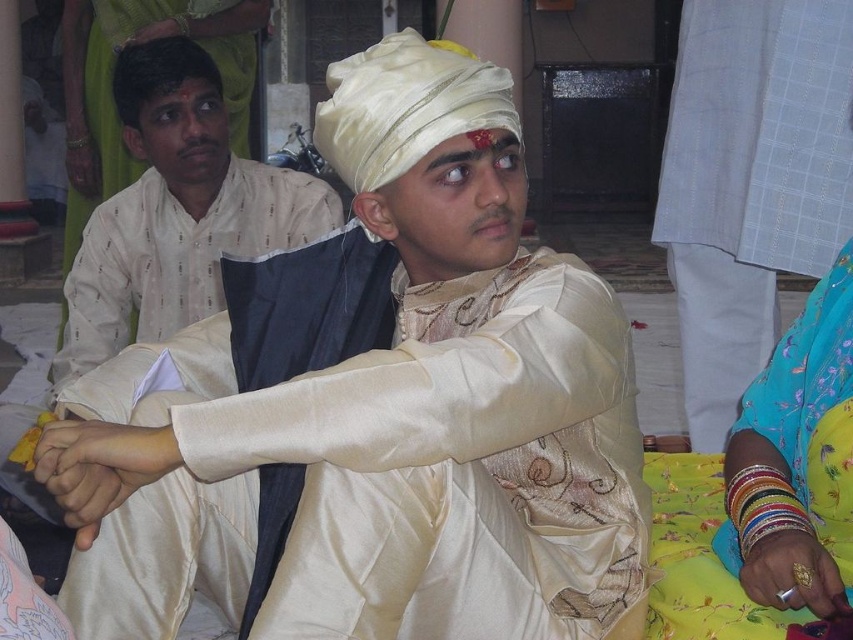
Question: Is satin beige turban at center smaller than multicolored bangles at lower right?

Choices:
 (A) no
 (B) yes

Answer: (A)

Question: Which point appears closest to the camera in this image?

Choices:
 (A) (813, 531)
 (B) (115, 195)
 (C) (144, 147)

Answer: (A)

Question: In this image, where is satin beige turban at center located relative to matte cream kurta at center?

Choices:
 (A) right
 (B) left

Answer: (A)

Question: Which point appears farthest from the camera in this image?

Choices:
 (A) (112, 86)
 (B) (480, 134)

Answer: (A)

Question: Does satin beige turban at center appear on the right side of reddish-brown paste at forehead center?

Choices:
 (A) no
 (B) yes

Answer: (A)

Question: Based on their relative distances, which object is farther from the satin white turban at center?

Choices:
 (A) multicolored bangles at lower right
 (B) reddish-brown paste at forehead center
 (C) matte beige kurta at left

Answer: (C)